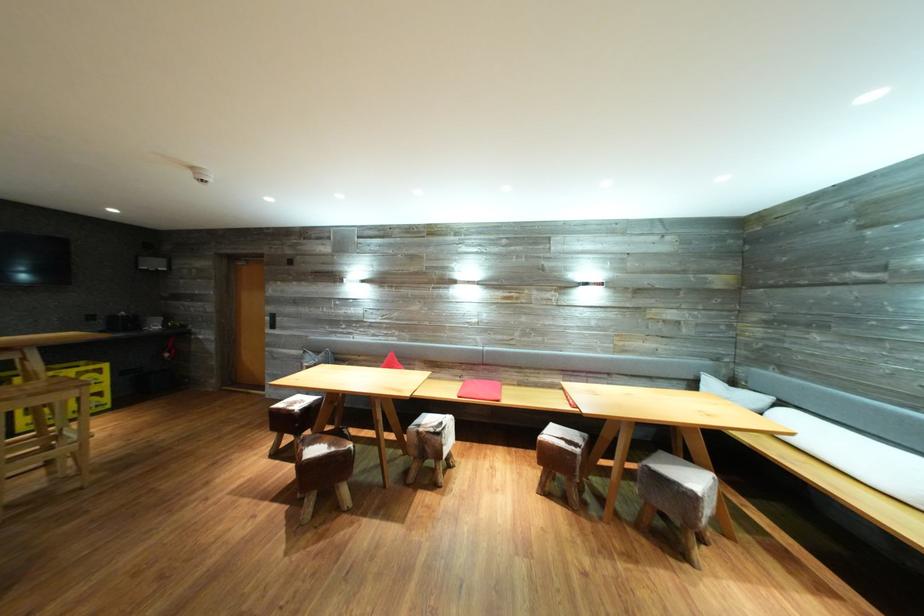
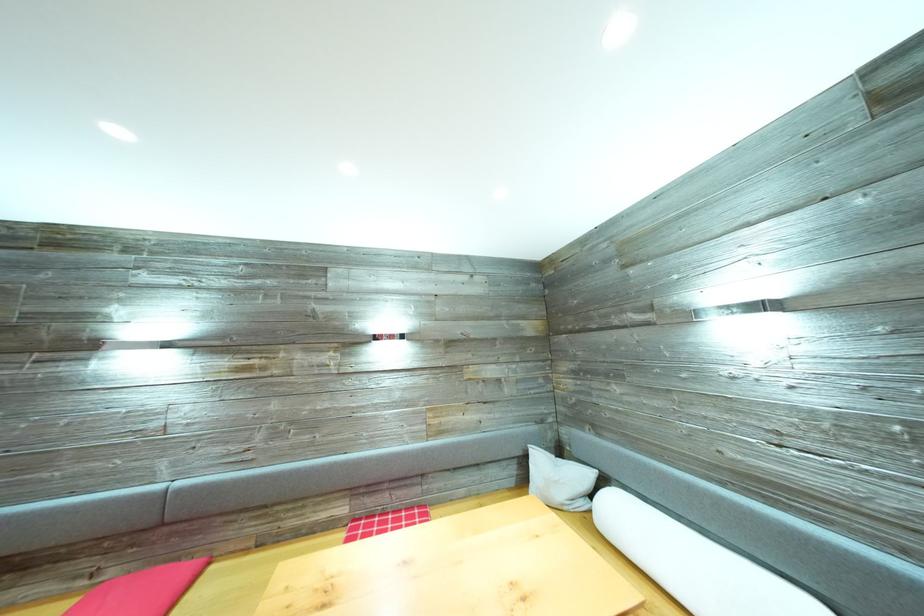
What movement of the cameraman would produce the second image?

The movement direction of the cameraman is right, forward.